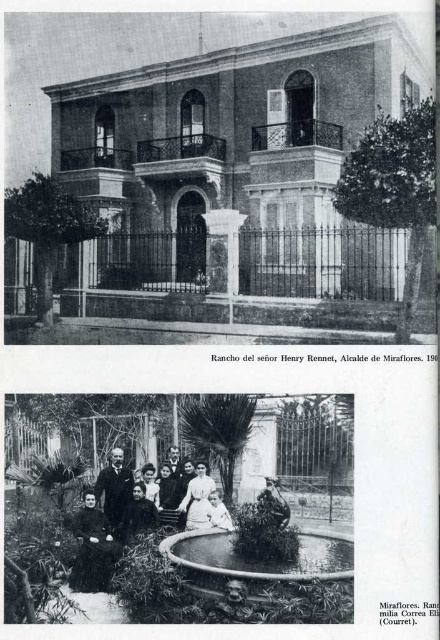
Question: Which point is farther to the camera?

Choices:
 (A) (77, 563)
 (B) (102, 582)

Answer: (A)

Question: Which point appears closest to the camera in this image?

Choices:
 (A) (99, 531)
 (B) (140, 522)

Answer: (A)

Question: Can you confirm if white cotton dress at center is thinner than dark velvet dress at center?

Choices:
 (A) no
 (B) yes

Answer: (A)

Question: Which point is farther to the camera?

Choices:
 (A) white cotton dress at center
 (B) dark velvet dress at center

Answer: (B)

Question: Is white cotton dress at center in front of dark velvet dress at center?

Choices:
 (A) no
 (B) yes

Answer: (B)

Question: Is white cotton dress at center below dark velvet dress at center?

Choices:
 (A) no
 (B) yes

Answer: (A)